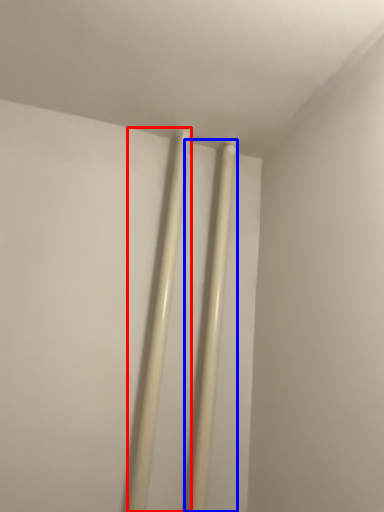
Question: Among these objects, which one is nearest to the camera, chopsticks (highlighted by a red box) or beam (highlighted by a blue box)?

Choices:
 (A) chopsticks
 (B) beam

Answer: (A)